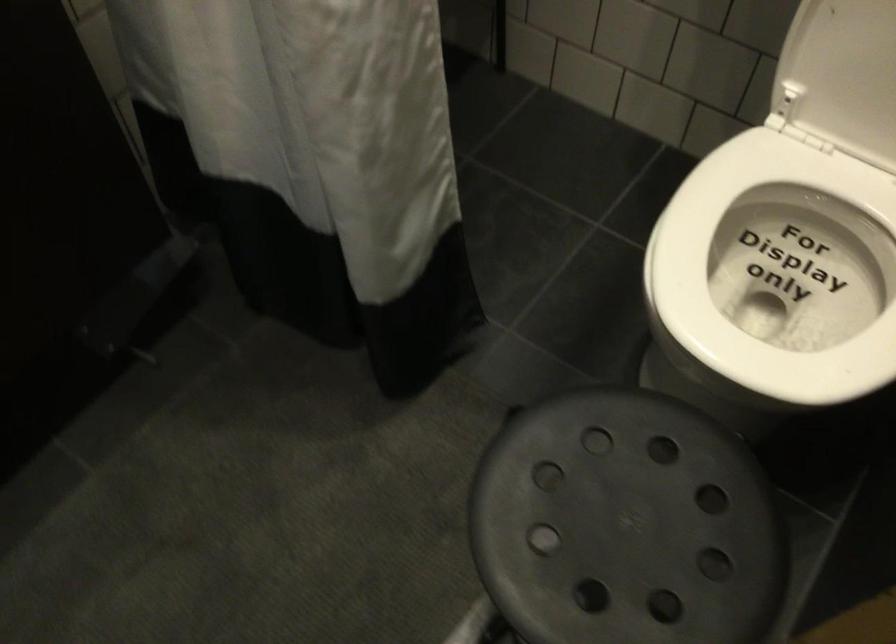
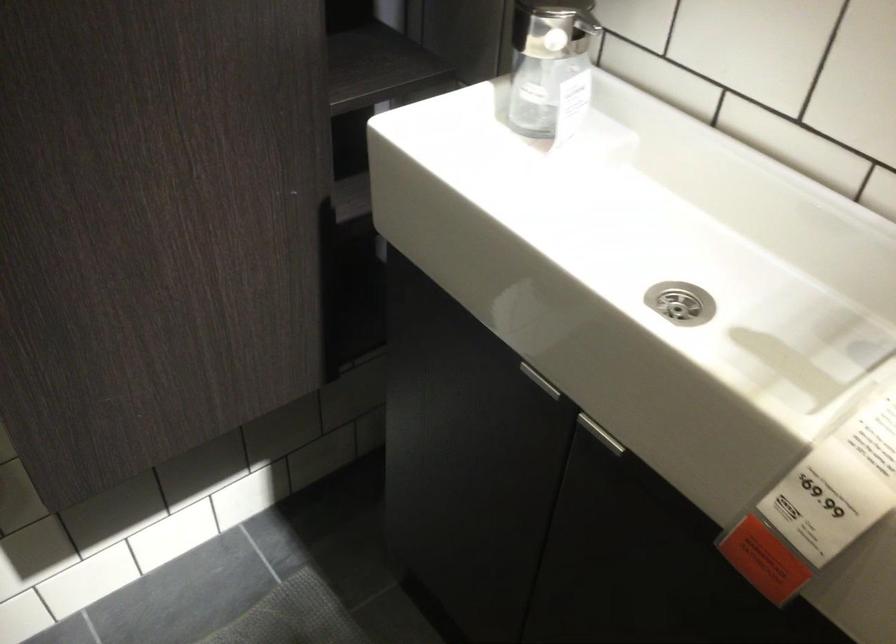
The images are taken continuously from a first-person perspective. In which direction is your viewpoint rotating?

The rotation direction of the camera is left-down.